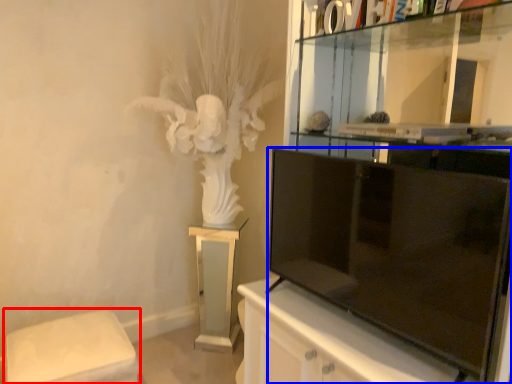
Question: Which object is further to the camera taking this photo, furniture (highlighted by a red box) or television (highlighted by a blue box)?

Choices:
 (A) furniture
 (B) television

Answer: (A)